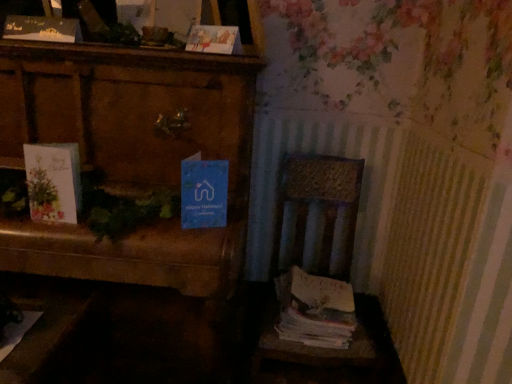
Where is `white paper stack at right`? white paper stack at right is located at coordinates (315, 310).

Image resolution: width=512 pixels, height=384 pixels. What do you see at coordinates (130, 155) in the screenshot?
I see `wooden chest at left` at bounding box center [130, 155].

The image size is (512, 384). Describe the element at coordinates (204, 193) in the screenshot. I see `blue paper at center, the 2th paperback book in the left-to-right sequence` at that location.

Identify the location of matte paper greeting card at left. This screenshot has height=384, width=512. (53, 181).

Which object is more forward, matte black card at upper left, which is the third paperback book from bottom to top, or matte paper card at upper center, which is the 2th paperback book in bottom-to-top order?

Positioned in front is matte paper card at upper center, which is the 2th paperback book in bottom-to-top order.

From the image's perspective, relative to matte paper card at upper center, positioned as the 3th paperback book in left-to-right order, is matte black card at upper left, which is the third paperback book from bottom to top, above or below?

From the image's perspective, matte black card at upper left, which is the third paperback book from bottom to top, appears above matte paper card at upper center, positioned as the 3th paperback book in left-to-right order.

Based on the photo, is matte black card at upper left, which is counted as the third paperback book, starting from the right, at the right side of matte paper card at upper center, which is the 2th paperback book in bottom-to-top order?

In fact, matte black card at upper left, which is counted as the third paperback book, starting from the right, is to the left of matte paper card at upper center, which is the 2th paperback book in bottom-to-top order.

Which of these two, matte black card at upper left, which is counted as the third paperback book, starting from the right, or matte paper card at upper center, positioned as the 3th paperback book in left-to-right order, is wider?

With larger width is matte paper card at upper center, positioned as the 3th paperback book in left-to-right order.

Does point (141, 70) appear closer or farther from the camera than point (76, 39)?

Point (141, 70) is positioned closer to the camera compared to point (76, 39).

Consider the image. Is wooden chest at left inside or outside of matte black card at upper left, which is the third paperback book from bottom to top?

wooden chest at left is not enclosed by matte black card at upper left, which is the third paperback book from bottom to top.

Locate an element on the screen. furniture lying in front of the matte black card at upper left, which is counted as the third paperback book, starting from the right is located at coordinates (130, 155).

Is wooden chest at left to the right of matte black card at upper left, arranged as the 1th paperback book when viewed from the left, from the viewer's perspective?

Yes, wooden chest at left is to the right of matte black card at upper left, arranged as the 1th paperback book when viewed from the left.

At what (x,y) coordinates should I click in order to perform the action: click on paperback book that is the 2nd one when counting upward from the wooden chair at lower right (from the image's perspective). Please return your answer as a coordinate pair (x, y). The width and height of the screenshot is (512, 384). Looking at the image, I should click on (214, 39).

Based on the photo, in the image, is matte paper card at upper center, positioned as the 3th paperback book in left-to-right order, positioned in front of or behind wooden chair at lower right?

In the image, matte paper card at upper center, positioned as the 3th paperback book in left-to-right order, appears behind wooden chair at lower right.

From the picture: Is matte paper card at upper center, which appears as the 2th paperback book when viewed from the top, surrounding wooden chair at lower right?

No, wooden chair at lower right is not surrounded by matte paper card at upper center, which appears as the 2th paperback book when viewed from the top.

Is matte paper card at upper center, which appears as the 2th paperback book when viewed from the top, touching wooden chair at lower right?

No, matte paper card at upper center, which appears as the 2th paperback book when viewed from the top, is not with wooden chair at lower right.

You are a GUI agent. You are given a task and a screenshot of the screen. Output one action in this format:
    pyautogui.click(x=<x>, y=<y>)
    Task: Click on the paperback book that is the 1st object above the matte paper greeting card at left (from a real-world perspective)
    
    Given the screenshot: What is the action you would take?
    pyautogui.click(x=42, y=29)

Which object is further away from the camera, matte paper greeting card at left or matte black card at upper left, which is counted as the third paperback book, starting from the right?

matte black card at upper left, which is counted as the third paperback book, starting from the right.

Which of these two, matte paper greeting card at left or matte black card at upper left, which is counted as the third paperback book, starting from the right, is wider?

With larger width is matte paper greeting card at left.

Considering the points (71, 222) and (76, 29), which point is behind, point (71, 222) or point (76, 29)?

Positioned behind is point (76, 29).

Relative to blue paper at center, the 2th paperback book in the left-to-right sequence, is wooden chair at lower right in front or behind?

Clearly, wooden chair at lower right is behind blue paper at center, the 2th paperback book in the left-to-right sequence.

From a real-world perspective, is wooden chair at lower right under blue paper at center, the third paperback book viewed from the top?

Indeed, from a real-world perspective, wooden chair at lower right is positioned beneath blue paper at center, the third paperback book viewed from the top.

Is wooden chair at lower right positioned with its back to blue paper at center, the third paperback book viewed from the top?

No, wooden chair at lower right is not facing the opposite direction of blue paper at center, the third paperback book viewed from the top.

From a real-world perspective, starting from the wooden chair at lower right, which paperback book is the 1st one vertically above it? Please provide its 2D coordinates.

[(204, 193)]

Does blue paper at center, the 2th paperback book in the left-to-right sequence, appear on the left side of wooden chair at lower right?

Correct, you'll find blue paper at center, the 2th paperback book in the left-to-right sequence, to the left of wooden chair at lower right.

Which point is more forward, (196, 196) or (315, 271)?

The point (196, 196) is more forward.

Is wooden chair at lower right completely or partially inside blue paper at center, the third paperback book viewed from the top?

No, wooden chair at lower right is not inside blue paper at center, the third paperback book viewed from the top.

From the image's perspective, between blue paper at center, the first paperback book ordered from the bottom, and wooden chair at lower right, who is located below?

wooden chair at lower right.

Is matte paper card at upper center, which appears as the 2th paperback book when viewed from the top, touching blue paper at center, which appears as the second paperback book when viewed from the right?

matte paper card at upper center, which appears as the 2th paperback book when viewed from the top, and blue paper at center, which appears as the second paperback book when viewed from the right, are clearly separated.

Consider the image. From a real-world perspective, is matte paper card at upper center, the first paperback book viewed from the right, above or below blue paper at center, which appears as the second paperback book when viewed from the right?

matte paper card at upper center, the first paperback book viewed from the right, is above blue paper at center, which appears as the second paperback book when viewed from the right.

From the image's perspective, which one is positioned lower, matte paper card at upper center, the first paperback book viewed from the right, or blue paper at center, the 2th paperback book in the left-to-right sequence?

blue paper at center, the 2th paperback book in the left-to-right sequence, is shown below in the image.

Can you tell me how much matte paper card at upper center, positioned as the 3th paperback book in left-to-right order, and blue paper at center, the first paperback book ordered from the bottom, differ in facing direction?

matte paper card at upper center, positioned as the 3th paperback book in left-to-right order, and blue paper at center, the first paperback book ordered from the bottom, are facing 25.1 degrees away from each other.

Starting from the matte paper card at upper center, which appears as the 2th paperback book when viewed from the top, which paperback book is the 2nd one to the left? Please provide its 2D coordinates.

[(42, 29)]

I want to click on the 3rd paperback book behind when counting from the wooden chest at left, so click(42, 29).

Estimate the real-world distances between objects in this image. Which object is further from wooden chest at left, blue paper at center, the 2th paperback book in the left-to-right sequence, or white paper stack at right?

white paper stack at right is positioned further to the anchor wooden chest at left.

Which object lies nearer to the anchor point matte paper card at upper center, positioned as the 3th paperback book in left-to-right order, matte black card at upper left, which is counted as the third paperback book, starting from the right, or white paper stack at right?

matte black card at upper left, which is counted as the third paperback book, starting from the right, is positioned closer to the anchor matte paper card at upper center, positioned as the 3th paperback book in left-to-right order.

Estimate the real-world distances between objects in this image. Which object is closer to white paper stack at right, wooden chair at lower right or blue paper at center, which appears as the second paperback book when viewed from the right?

Based on the image, wooden chair at lower right appears to be nearer to white paper stack at right.

Looking at the image, which one is located closer to blue paper at center, the 2th paperback book in the left-to-right sequence, matte paper card at upper center, positioned as the 3th paperback book in left-to-right order, or matte black card at upper left, acting as the 1th paperback book starting from the top?

Based on the image, matte paper card at upper center, positioned as the 3th paperback book in left-to-right order, appears to be nearer to blue paper at center, the 2th paperback book in the left-to-right sequence.

Which object lies nearer to the anchor point white paper stack at right, matte black card at upper left, which is counted as the third paperback book, starting from the right, or matte paper greeting card at left?

matte paper greeting card at left.

Which object lies further to the anchor point matte paper greeting card at left, matte black card at upper left, arranged as the 1th paperback book when viewed from the left, or wooden chair at lower right?

wooden chair at lower right is positioned further to the anchor matte paper greeting card at left.

From the image, which object appears to be nearer to blue paper at center, the first paperback book ordered from the bottom, wooden chest at left or matte paper card at upper center, the first paperback book viewed from the right?

wooden chest at left lies closer to blue paper at center, the first paperback book ordered from the bottom, than the other object.

Based on the photo, estimate the real-world distances between objects in this image. Which object is closer to matte black card at upper left, which is counted as the third paperback book, starting from the right, matte paper card at upper center, positioned as the 3th paperback book in left-to-right order, or wooden chair at lower right?

Based on the image, matte paper card at upper center, positioned as the 3th paperback book in left-to-right order, appears to be nearer to matte black card at upper left, which is counted as the third paperback book, starting from the right.

I want to click on chair between matte black card at upper left, arranged as the 1th paperback book when viewed from the left, and white paper stack at right from top to bottom, so click(315, 255).

The width and height of the screenshot is (512, 384). I want to click on furniture between matte black card at upper left, arranged as the 1th paperback book when viewed from the left, and wooden chair at lower right from left to right, so click(130, 155).

This screenshot has height=384, width=512. Find the location of `book between matte black card at upper left, arranged as the 1th paperback book when viewed from the left, and matte paper card at upper center, which is the 2th paperback book in bottom-to-top order, in the horizontal direction`. book between matte black card at upper left, arranged as the 1th paperback book when viewed from the left, and matte paper card at upper center, which is the 2th paperback book in bottom-to-top order, in the horizontal direction is located at coordinates (53, 181).

Where is `furniture between matte paper card at upper center, positioned as the 3th paperback book in left-to-right order, and white paper stack at right, in the vertical direction`? The image size is (512, 384). furniture between matte paper card at upper center, positioned as the 3th paperback book in left-to-right order, and white paper stack at right, in the vertical direction is located at coordinates (130, 155).